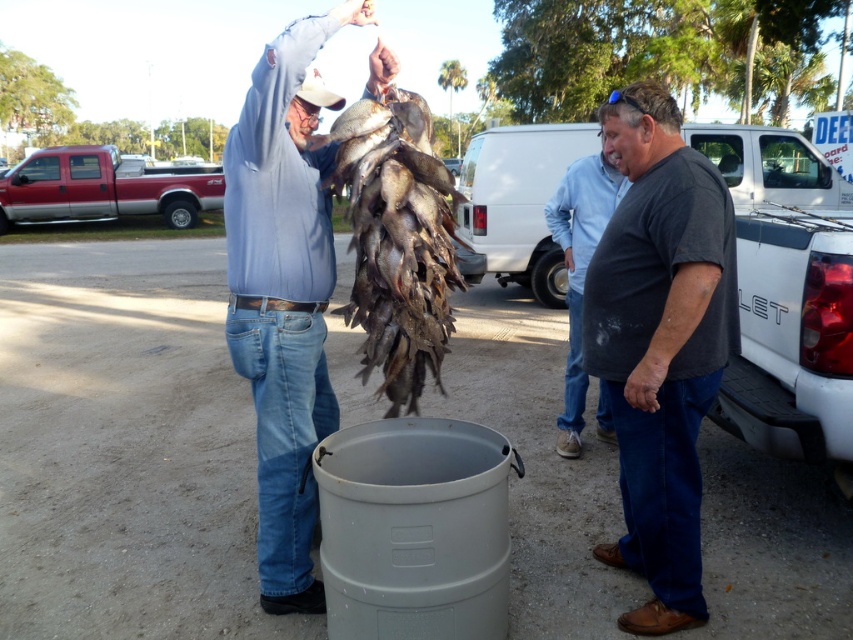
You are a photographer trying to capture a photo of the light blue shirt at center and the red metallic pickup truck at left. Which object should you focus on first if you want to ensure both are in sharp focus?

The light blue shirt at center is bigger than the red metallic pickup truck at left, so you should focus on the light blue shirt at center first to ensure both are in sharp focus.